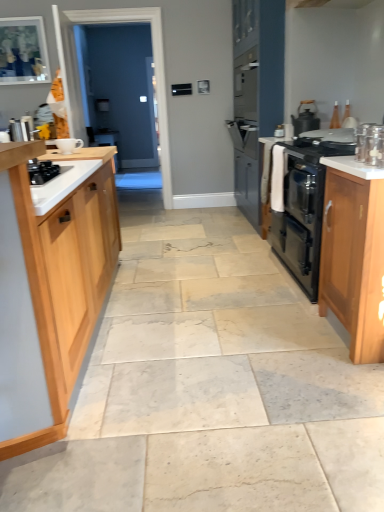
Question: Is white glossy countertop at right taller than clear glass jar at upper right, the first kitchen appliance when ordered from bottom to top?

Choices:
 (A) yes
 (B) no

Answer: (B)

Question: Is the position of white glossy countertop at right more distant than that of clear glass jar at upper right, acting as the second kitchen appliance starting from the back?

Choices:
 (A) no
 (B) yes

Answer: (A)

Question: Is white glossy countertop at right with clear glass jar at upper right, which is the 2th kitchen appliance in top-to-bottom order?

Choices:
 (A) yes
 (B) no

Answer: (B)

Question: From the image's perspective, would you say white glossy countertop at right is positioned over clear glass jar at upper right, acting as the second kitchen appliance starting from the back?

Choices:
 (A) yes
 (B) no

Answer: (B)

Question: From a real-world perspective, is white glossy countertop at right beneath clear glass jar at upper right, the first kitchen appliance when ordered from bottom to top?

Choices:
 (A) yes
 (B) no

Answer: (A)

Question: Would you consider white glossy countertop at right to be distant from clear glass jar at upper right, the first kitchen appliance when ordered from bottom to top?

Choices:
 (A) yes
 (B) no

Answer: (B)

Question: Does metallic silver kettle at left, marked as the first appliance in a back-to-front arrangement, have a lesser height compared to light wood cabinet at right, marked as the second cabinetry in a left-to-right arrangement?

Choices:
 (A) yes
 (B) no

Answer: (A)

Question: Is metallic silver kettle at left, marked as the first appliance in a back-to-front arrangement, looking in the opposite direction of light wood cabinet at right, which ranks as the 1th cabinetry in right-to-left order?

Choices:
 (A) no
 (B) yes

Answer: (A)

Question: Is the position of metallic silver kettle at left, the second appliance from the front, more distant than that of light wood cabinet at right, which ranks as the 1th cabinetry in right-to-left order?

Choices:
 (A) yes
 (B) no

Answer: (A)

Question: Is metallic silver kettle at left, which is counted as the first appliance, starting from the top, bigger than light wood cabinet at right, which ranks as the 1th cabinetry in right-to-left order?

Choices:
 (A) yes
 (B) no

Answer: (B)

Question: Can you confirm if metallic silver kettle at left, which ranks as the second appliance in right-to-left order, is wider than light wood cabinet at right, marked as the second cabinetry in a left-to-right arrangement?

Choices:
 (A) no
 (B) yes

Answer: (A)

Question: From the image's perspective, is metallic silver kettle at left, which is counted as the first appliance, starting from the top, under light wood cabinet at right, marked as the second cabinetry in a left-to-right arrangement?

Choices:
 (A) yes
 (B) no

Answer: (B)

Question: From a real-world perspective, is black matte gas stove at left physically above metallic silver kettle at left, the second appliance from the front?

Choices:
 (A) yes
 (B) no

Answer: (B)